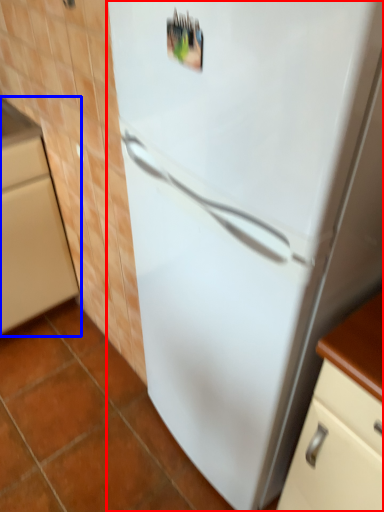
Question: Which point is further to the camera, refrigerator (highlighted by a red box) or cabinetry (highlighted by a blue box)?

Choices:
 (A) refrigerator
 (B) cabinetry

Answer: (B)